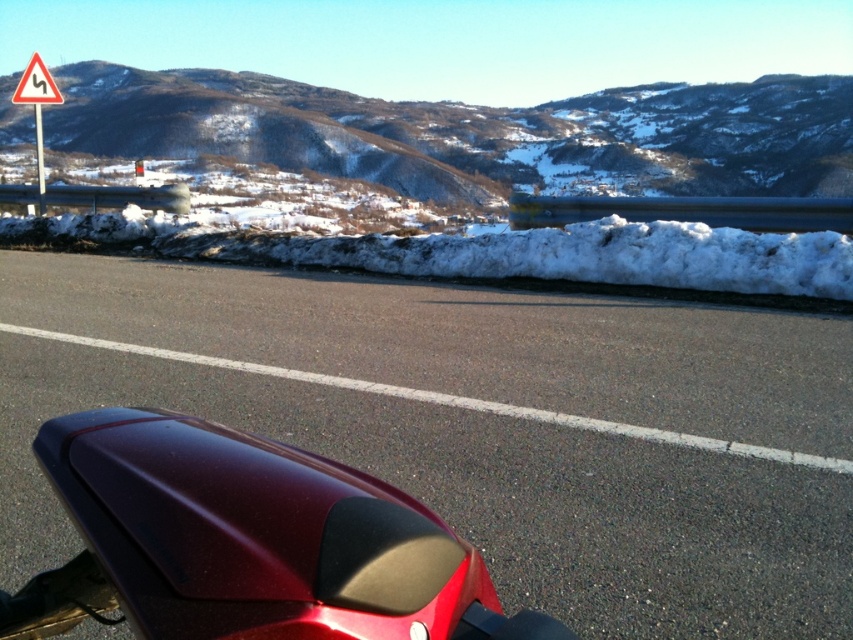
You are standing 10 feet away from the glossy red motorcycle at lower center. Can you comfortably reach out and touch it without moving your feet?

The glossy red motorcycle at lower center is 9.80 feet away from the viewer, so yes, you can comfortably reach out and touch it without moving your feet since it is within arm reach.

You are riding a motorcycle and want to take a photo of the snowy rocky mountain at upper center. To ensure the glossy maroon motorcycle at center is also in the frame, where should you position the motorcycle relative to the mountain?

The glossy maroon motorcycle at center is positioned under the snowy rocky mountain at upper center, so you should position the motorcycle directly below the mountain to include both in the photo.